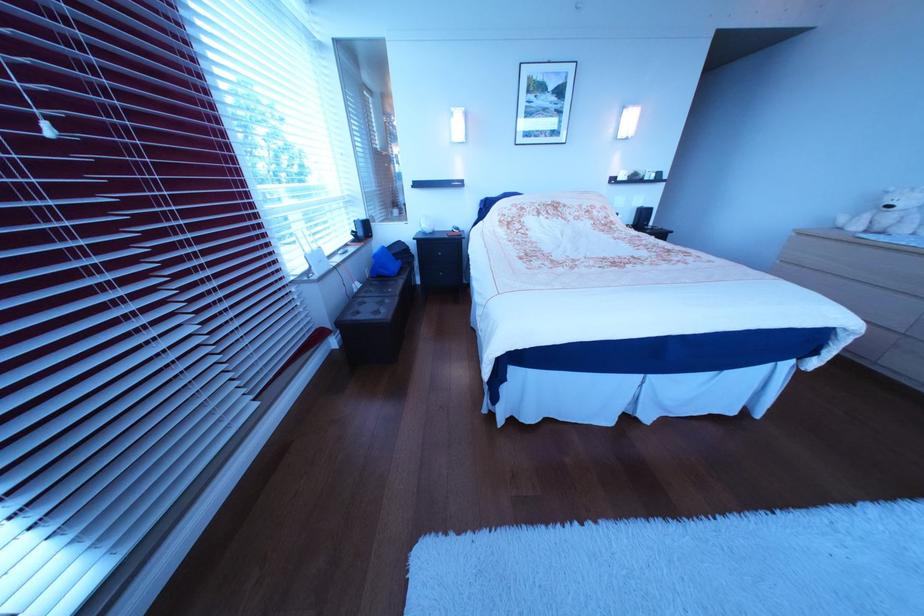
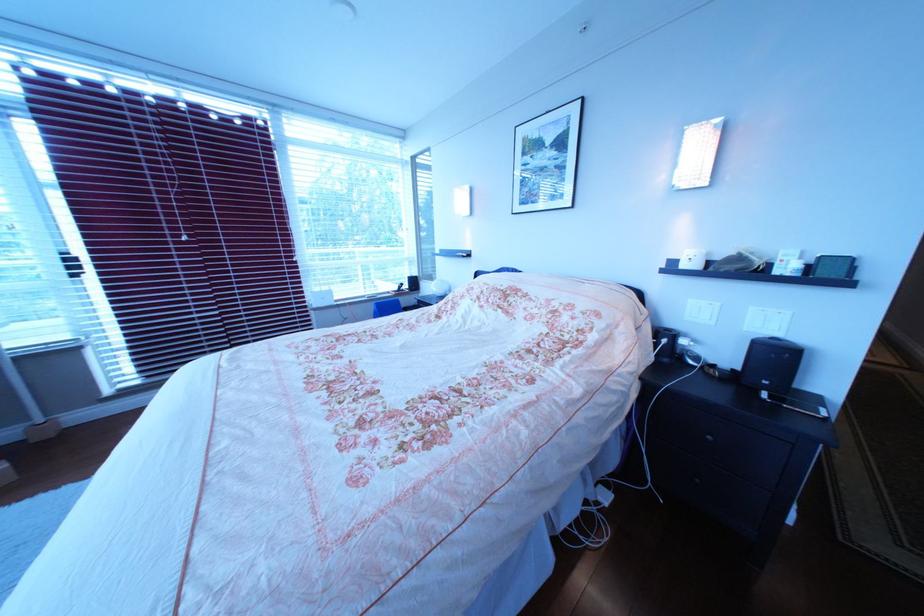
Where in the second image is the point corresponding to [361,254] from the first image?

(392, 299)